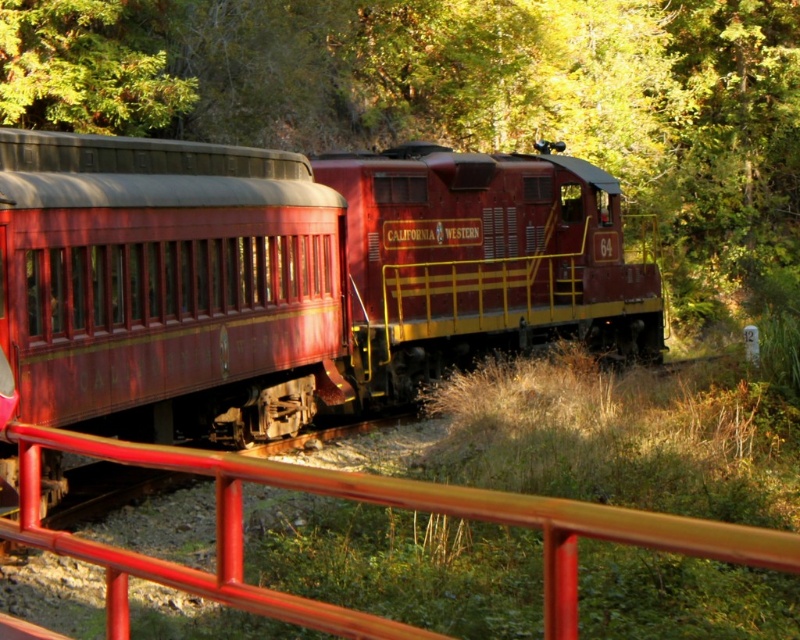
You are a photographer positioned at the center of the scene. You want to capture a photo that includes both the metallic red rail at center and the green leafy tree at upper left. Based on their positions, which object should you adjust your camera angle to include first?

The metallic red rail at center is to the right of green leafy tree at upper left, so you should adjust your camera angle to include the green leafy tree at upper left first before framing the metallic red rail at center.

You are a photographer planning to capture the metallic red rail at center and the green leafy tree at upper left in a single frame. Based on their widths, which object should you focus on to ensure both fit within the camera frame?

The metallic red rail at center has a lesser width compared to green leafy tree at upper left. Therefore, you should focus on the green leafy tree at upper left since it is wider and will require more space in the frame to capture fully.